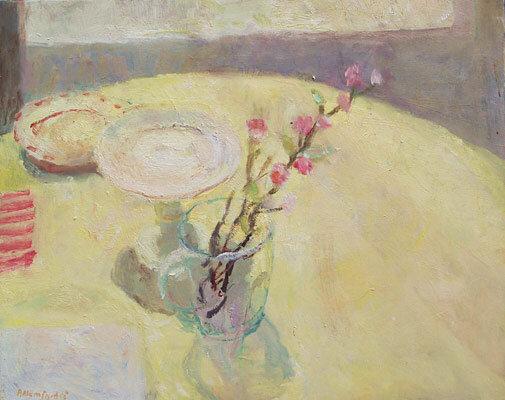
The image size is (505, 400). Find the location of `yellow tablecloth`. yellow tablecloth is located at coordinates click(x=80, y=263), click(x=234, y=103), click(x=434, y=199), click(x=394, y=340).